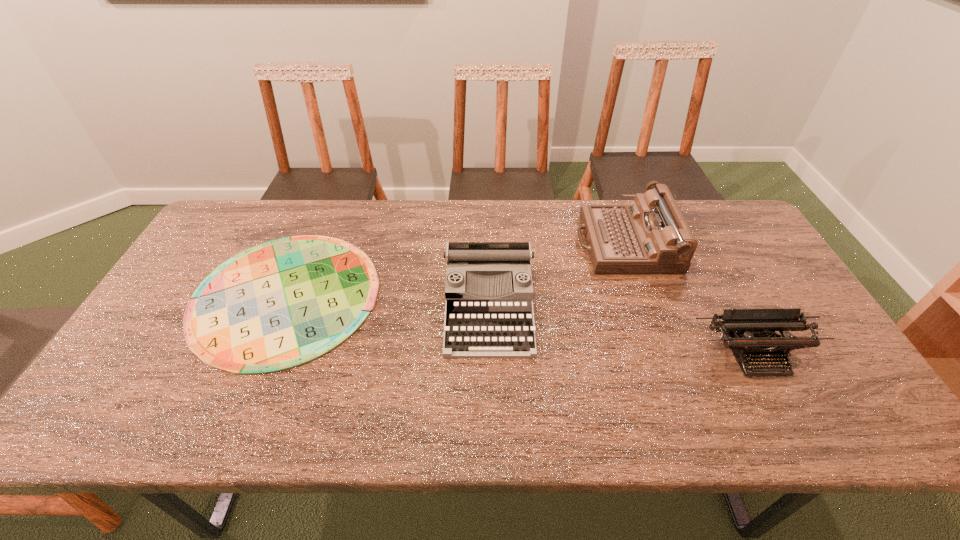
I want to click on the tallest object, so click(x=650, y=235).

What are the coordinates of `the leftmost typewriter` in the screenshot? It's located at (x=491, y=317).

You are a GUI agent. You are given a task and a screenshot of the screen. Output one action in this format:
    pyautogui.click(x=<x>, y=<y>)
    Task: Click on the shortest object
    
    Given the screenshot: What is the action you would take?
    pyautogui.click(x=283, y=303)

I want to click on gameboard, so click(283, 303).

Where is `free space located on the keyboard of the tallest object`? free space located on the keyboard of the tallest object is located at coordinates (450, 243).

Where is `free spot located 0.140m on the keyboard of the tallest object`? This screenshot has height=540, width=960. free spot located 0.140m on the keyboard of the tallest object is located at coordinates (533, 243).

Find the location of a particular element. vacant space located 0.070m on the keyboard of the tallest object is located at coordinates (555, 243).

Image resolution: width=960 pixels, height=540 pixels. What are the coordinates of `free spot located on the typing side of the third object from right to left` in the screenshot? It's located at (491, 394).

Image resolution: width=960 pixels, height=540 pixels. I want to click on vacant space situated 0.100m on the right of the shortest object, so click(413, 295).

Find the location of a particular element. The image size is (960, 540). typewriter that is at the far edge is located at coordinates (650, 235).